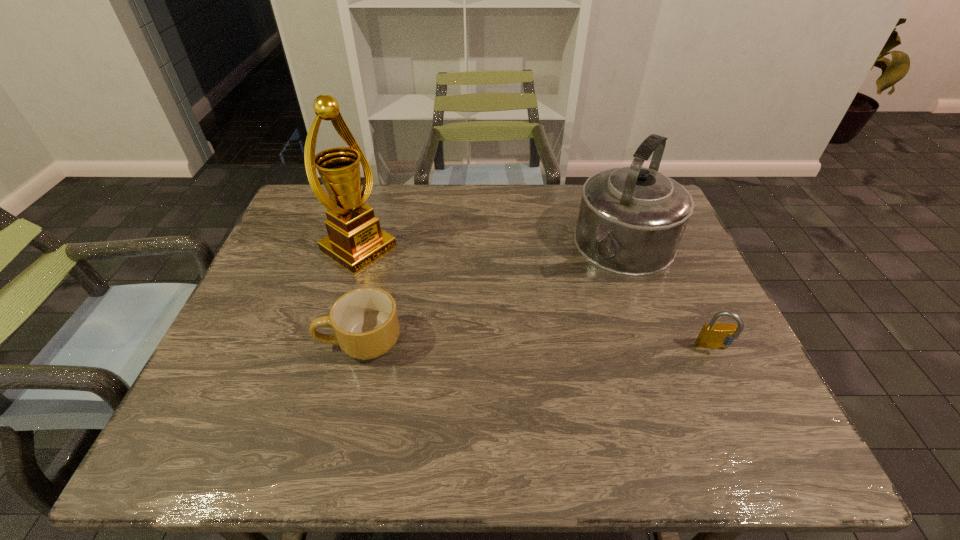
At what (x,y) coordinates should I click in order to perform the action: click on free space between the kettle and the shortest object. Please return your answer as a coordinate pair (x, y). Looking at the image, I should click on (493, 294).

You are a GUI agent. You are given a task and a screenshot of the screen. Output one action in this format:
    pyautogui.click(x=<x>, y=<y>)
    Task: Click on the vacant area that lies between the kettle and the tallest object
    
    Given the screenshot: What is the action you would take?
    pyautogui.click(x=492, y=248)

Locate an element on the screen. Image resolution: width=960 pixels, height=540 pixels. unoccupied area between the mug and the second tallest object is located at coordinates (493, 294).

Locate an element on the screen. The height and width of the screenshot is (540, 960). vacant area that lies between the shortest object and the padlock is located at coordinates (538, 345).

Locate an element on the screen. The image size is (960, 540). free area in between the padlock and the shortest object is located at coordinates (538, 345).

Where is `object that is the closest to the award`? object that is the closest to the award is located at coordinates (365, 322).

Where is `object that is the second closest to the padlock`? object that is the second closest to the padlock is located at coordinates pyautogui.click(x=365, y=322).

The width and height of the screenshot is (960, 540). What are the coordinates of `free region that satisfies the following two spatial constraints: 1. on the back side of the award; 2. on the left side of the kettle` in the screenshot? It's located at (359, 247).